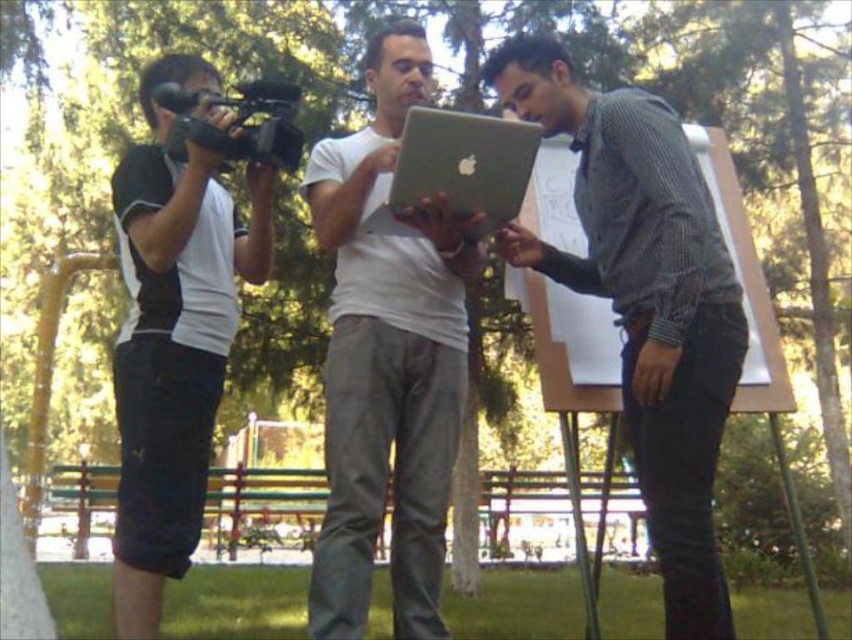
You are standing at the point with coordinates point (488, 177) and want to walk towards the point with coordinates point (671, 275). Which direction should you move?

You should move forward because point (671, 275) is in front of point (488, 177).

You are a delivery person who needs to place a 12 inch wide package between the matte gray laptop at right and the silver metallic laptop at center. Can the package fit in the space between them?

The space between the matte gray laptop at right and the silver metallic laptop at center is 13.19 inches. Since the package is 12 inches wide, it can fit as the space is wider than the package.

You are planning to place a small plant pot between the black fabric camera at left and the silver metallic laptop at center. Considering their heights, which object will the top of the plant pot align with when placed exactly in the middle between them?

The black fabric camera at left is taller than the silver metallic laptop at center, so the top of the plant pot will align with the silver metallic laptop at center when placed exactly in the middle between them.